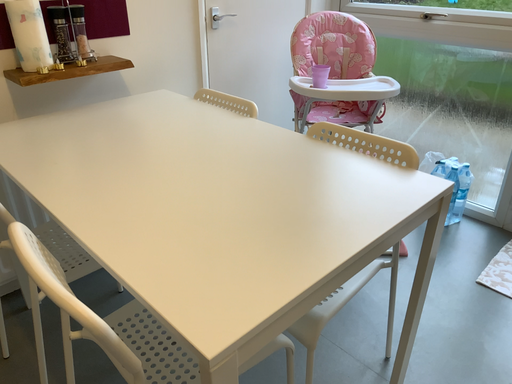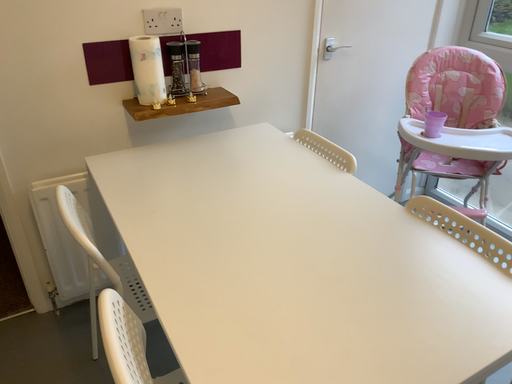
Question: Which way did the camera rotate in the video?

Choices:
 (A) rotated left
 (B) rotated right

Answer: (A)